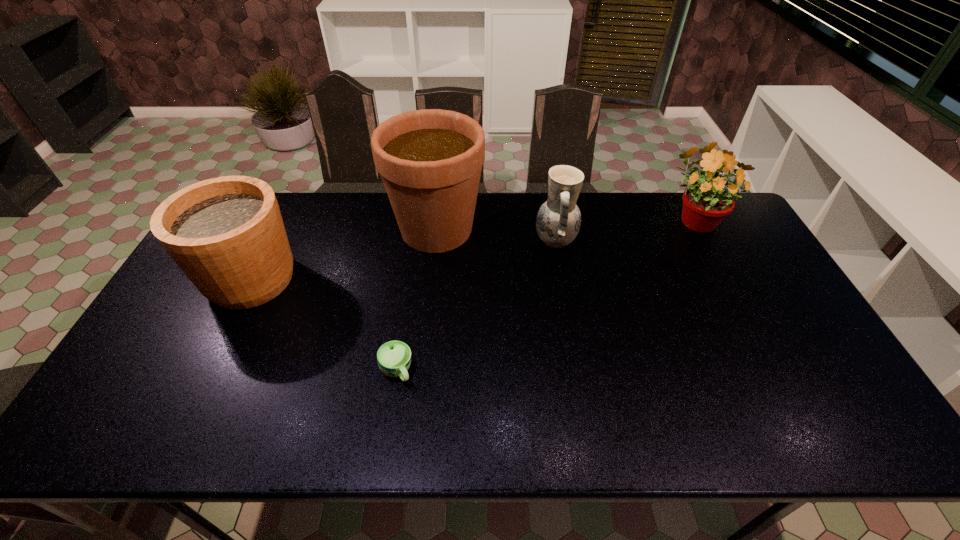
Image resolution: width=960 pixels, height=540 pixels. In order to click on the tallest object in this screenshot , I will do `click(430, 160)`.

The width and height of the screenshot is (960, 540). I want to click on the second flowerpot from left to right, so click(430, 160).

Find the location of a particular element. This screenshot has height=540, width=960. the rightmost flowerpot is located at coordinates (705, 205).

Where is `the leftmost object`? The width and height of the screenshot is (960, 540). the leftmost object is located at coordinates (226, 234).

At what (x,y) coordinates should I click in order to perform the action: click on the second object from right to left. Please return your answer as a coordinate pair (x, y). This screenshot has height=540, width=960. Looking at the image, I should click on (558, 221).

Where is `the nearest object`? This screenshot has height=540, width=960. the nearest object is located at coordinates (394, 357).

Identify the location of cup. The width and height of the screenshot is (960, 540). (394, 357).

The height and width of the screenshot is (540, 960). In order to click on vacant space positioned 0.200m on the front of the tallest object in this screenshot , I will do `click(428, 312)`.

I want to click on vacant point located 0.140m on the back of the leftmost flowerpot, so click(x=281, y=219).

Where is `vacant space located on either side of the second object from right to left`? vacant space located on either side of the second object from right to left is located at coordinates (467, 241).